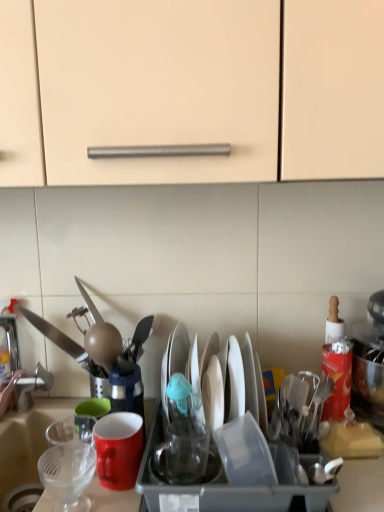
Find the location of a particular element. transparent plastic cup at center, acting as the 2th tableware starting from the left is located at coordinates (184, 450).

Where is `matte red mug at center`? The image size is (384, 512). matte red mug at center is located at coordinates (118, 449).

How much space does clear plastic strainer at lower left, acting as the second tableware starting from the right, occupy vertically?

clear plastic strainer at lower left, acting as the second tableware starting from the right, is 4.85 inches tall.

At what (x,y) coordinates should I click in order to perform the action: click on transparent plastic cup at center, which appears as the first tableware when viewed from the right. Please return your answer as a coordinate pair (x, y). Looking at the image, I should click on (184, 450).

Considering the positions of objects matte red mug at center and transparent plastic sink at lower left in the image provided, who is in front, matte red mug at center or transparent plastic sink at lower left?

transparent plastic sink at lower left is in front.

Between point (133, 431) and point (33, 469), which one is positioned in front?

The point (133, 431) is more forward.

Is transparent plastic sink at lower left located within matte red mug at center?

No, transparent plastic sink at lower left is not surrounded by matte red mug at center.

Is matte red mug at center directly adjacent to transparent plastic sink at lower left?

No.

Considering the positions of objects transparent plastic cup at center, which appears as the first tableware when viewed from the right, and clear plastic strainer at lower left, which is counted as the 1th tableware, starting from the left, in the image provided, who is more to the left, transparent plastic cup at center, which appears as the first tableware when viewed from the right, or clear plastic strainer at lower left, which is counted as the 1th tableware, starting from the left,?

Positioned to the left is clear plastic strainer at lower left, which is counted as the 1th tableware, starting from the left.

Is transparent plastic cup at center, acting as the 2th tableware starting from the left, completely or partially outside of clear plastic strainer at lower left, acting as the second tableware starting from the right?

Yes, transparent plastic cup at center, acting as the 2th tableware starting from the left, is outside of clear plastic strainer at lower left, acting as the second tableware starting from the right.

The height and width of the screenshot is (512, 384). Find the location of `tableware on the right of the clear plastic strainer at lower left, which is counted as the 1th tableware, starting from the left`. tableware on the right of the clear plastic strainer at lower left, which is counted as the 1th tableware, starting from the left is located at coordinates 184,450.

Is clear plastic strainer at lower left, which is counted as the 1th tableware, starting from the left, bigger than matte red mug at center?

Incorrect, clear plastic strainer at lower left, which is counted as the 1th tableware, starting from the left, is not larger than matte red mug at center.

Which object is more forward, clear plastic strainer at lower left, which is counted as the 1th tableware, starting from the left, or matte red mug at center?

Positioned in front is clear plastic strainer at lower left, which is counted as the 1th tableware, starting from the left.

Locate an element on the screen. This screenshot has width=384, height=512. coffee cup located above the clear plastic strainer at lower left, which is counted as the 1th tableware, starting from the left (from a real-world perspective) is located at coordinates (118, 449).

Is clear plastic strainer at lower left, which is counted as the 1th tableware, starting from the left, taller or shorter than matte red mug at center?

clear plastic strainer at lower left, which is counted as the 1th tableware, starting from the left, is taller than matte red mug at center.

From the image's perspective, which is above, transparent plastic cup at center, which appears as the first tableware when viewed from the right, or transparent plastic sink at lower left?

transparent plastic cup at center, which appears as the first tableware when viewed from the right.

How many degrees apart are the facing directions of transparent plastic cup at center, acting as the 2th tableware starting from the left, and transparent plastic sink at lower left?

transparent plastic cup at center, acting as the 2th tableware starting from the left, and transparent plastic sink at lower left are facing 0.455 degrees away from each other.

Based on the photo, is transparent plastic cup at center, which appears as the first tableware when viewed from the right, further to camera compared to transparent plastic sink at lower left?

Yes.

Does point (179, 471) come closer to viewer compared to point (12, 452)?

Yes, point (179, 471) is closer to viewer.

Find the location of a particular element. The width and height of the screenshot is (384, 512). sink lying on the left of matte red mug at center is located at coordinates (27, 440).

Are transparent plastic sink at lower left and matte red mug at center located far from each other?

No, there isn't a large distance between transparent plastic sink at lower left and matte red mug at center.

Does point (56, 412) lie in front of point (136, 429)?

No, it is not.

Who is shorter, transparent plastic sink at lower left or matte red mug at center?

matte red mug at center.

From a real-world perspective, which is physically above, white paper at right or transparent plastic cup at center, acting as the 2th tableware starting from the left?

white paper at right, from a real-world perspective.

Would you say white paper at right is a long distance from transparent plastic cup at center, which appears as the first tableware when viewed from the right?

They are positioned close to each other.

Is the depth of white paper at right less than that of transparent plastic cup at center, which appears as the first tableware when viewed from the right?

No.

Can you confirm if white paper at right is positioned to the right of transparent plastic cup at center, acting as the 2th tableware starting from the left?

Correct, you'll find white paper at right to the right of transparent plastic cup at center, acting as the 2th tableware starting from the left.

From their relative heights in the image, would you say matte red mug at center is taller or shorter than white paper at right?

In the image, matte red mug at center appears to be shorter than white paper at right.

Based on the photo, is matte red mug at center far from white paper at right?

They are positioned close to each other.

From a real-world perspective, is matte red mug at center located beneath white paper at right?

Yes, from a real-world perspective, matte red mug at center is below white paper at right.

I want to click on sink that is on the left side of matte red mug at center, so click(x=27, y=440).

Locate an element on the screen. This screenshot has width=384, height=512. tableware above the clear plastic strainer at lower left, which is counted as the 1th tableware, starting from the left (from a real-world perspective) is located at coordinates (184, 450).

Estimate the real-world distances between objects in this image. Which object is further from matte red mug at center, white paper at right or clear plastic strainer at lower left, which is counted as the 1th tableware, starting from the left?

white paper at right is further to matte red mug at center.

From the image, which object appears to be nearer to transparent plastic sink at lower left, clear plastic strainer at lower left, which is counted as the 1th tableware, starting from the left, or white paper at right?

clear plastic strainer at lower left, which is counted as the 1th tableware, starting from the left, is closer to transparent plastic sink at lower left.

Which object lies nearer to the anchor point clear plastic strainer at lower left, which is counted as the 1th tableware, starting from the left, matte red mug at center or transparent plastic sink at lower left?

Among the two, matte red mug at center is located nearer to clear plastic strainer at lower left, which is counted as the 1th tableware, starting from the left.

Which object lies nearer to the anchor point transparent plastic cup at center, which appears as the first tableware when viewed from the right, white paper at right or clear plastic strainer at lower left, which is counted as the 1th tableware, starting from the left?

Among the two, clear plastic strainer at lower left, which is counted as the 1th tableware, starting from the left, is located nearer to transparent plastic cup at center, which appears as the first tableware when viewed from the right.

From the image, which object appears to be nearer to clear plastic strainer at lower left, acting as the second tableware starting from the right, white paper at right or transparent plastic cup at center, acting as the 2th tableware starting from the left?

transparent plastic cup at center, acting as the 2th tableware starting from the left, is closer to clear plastic strainer at lower left, acting as the second tableware starting from the right.

When comparing their distances from matte red mug at center, does transparent plastic sink at lower left or clear plastic strainer at lower left, acting as the second tableware starting from the right, seem further?

transparent plastic sink at lower left.

When comparing their distances from matte red mug at center, does transparent plastic cup at center, which appears as the first tableware when viewed from the right, or transparent plastic sink at lower left seem further?

Among the two, transparent plastic sink at lower left is located further to matte red mug at center.

Considering their positions, is transparent plastic sink at lower left positioned closer to clear plastic strainer at lower left, acting as the second tableware starting from the right, than transparent plastic cup at center, acting as the 2th tableware starting from the left?

transparent plastic sink at lower left is positioned closer to the anchor clear plastic strainer at lower left, acting as the second tableware starting from the right.

Locate an element on the screen. The image size is (384, 512). tableware between transparent plastic sink at lower left and matte red mug at center in the horizontal direction is located at coordinates (68, 474).

The width and height of the screenshot is (384, 512). What are the coordinates of `coffee cup between transparent plastic sink at lower left and white paper at right from left to right` in the screenshot? It's located at 118,449.

At what (x,y) coordinates should I click in order to perform the action: click on coffee cup between clear plastic strainer at lower left, acting as the second tableware starting from the right, and transparent plastic cup at center, which appears as the first tableware when viewed from the right, from left to right. Please return your answer as a coordinate pair (x, y). The image size is (384, 512). Looking at the image, I should click on (118, 449).

Identify the location of tableware between transparent plastic sink at lower left and transparent plastic cup at center, acting as the 2th tableware starting from the left, from left to right. (68, 474).